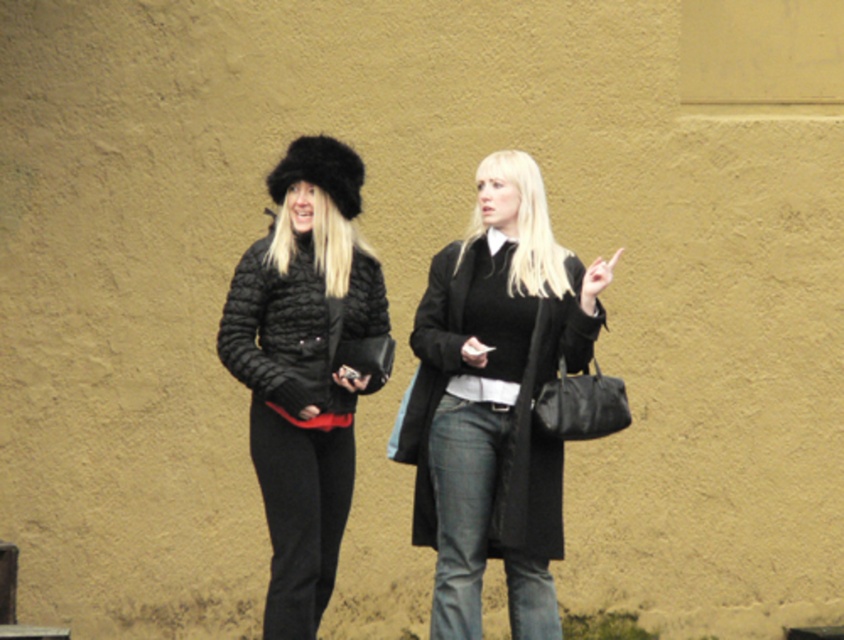
You are a photographer trying to capture a photo of the two people in the scene. The matte black fur hat at upper left is important for the composition. Where should you position your camera relative to the hat to ensure it is centered in the frame?

To center the matte black fur hat at upper left in the frame, position the camera so that the hat is at the coordinates point (304, 369).

You are a photographer trying to capture a photo of the two people. You want to ensure that the matte black fur hat at upper left and the black matte coat at center are both clearly visible in the frame. Based on their positions, which object should be placed closer to the left side of the photo?

The matte black fur hat at upper left should be placed closer to the left side of the photo since it is positioned to the left of the black matte coat at center.